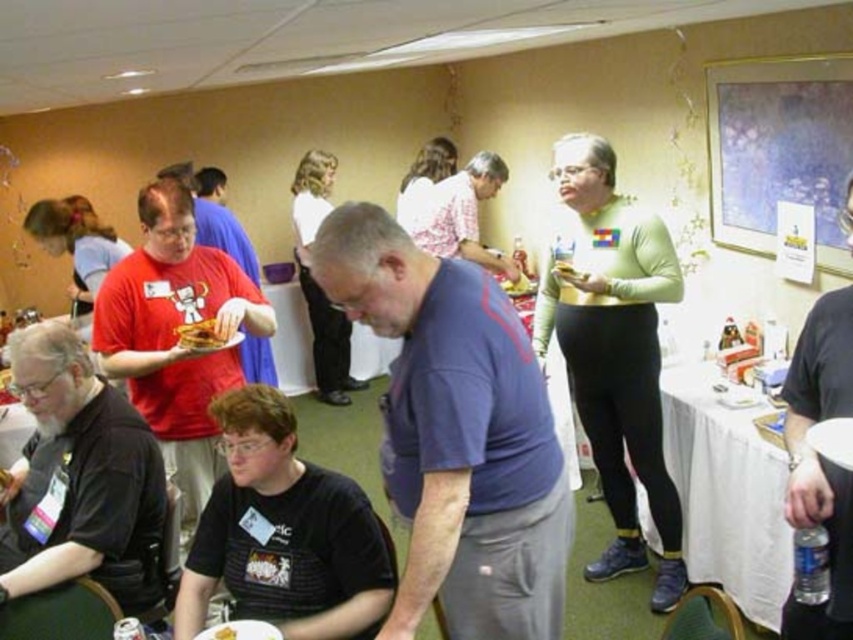
You are a guest at this event and want to place your drink on the nearest surface. Which object between the blue cotton shirt at center and the white cloth table at right is closer to you?

The blue cotton shirt at center is closer to the viewer than the white cloth table at right, so you should place your drink on the blue cotton shirt at center.